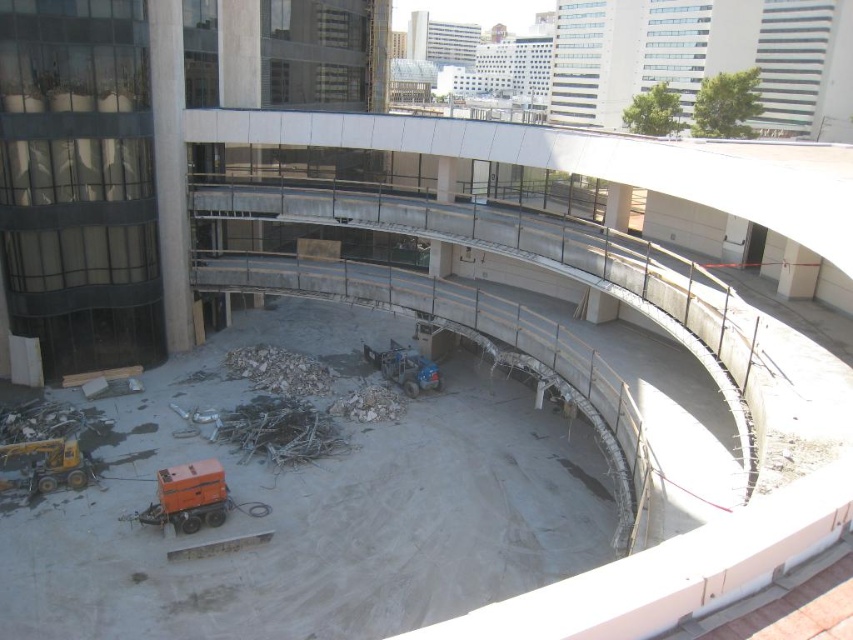
You are a construction worker standing at the edge of the construction site. You need to reach the orange rubberized machine at center to check its fuel level. Considering the distance, can you safely walk to it without needing any additional equipment?

The orange rubberized machine at center is 61.26 feet away from the viewer. Since this distance is manageable on foot, you can safely walk to it without needing additional equipment.

You are a construction worker standing at the orange generator near the bottom left corner of the construction site. You need to reach the curved walkway in the middle of the site. There are two points marked on your map as point A at coordinates point A is point [177,499] and point B at coordinates point B is point [422,355]. Which point should you head towards to get closer to the walkway?

You should head towards point A at coordinates point A is point [177,499] because it is in front of point B at coordinates point B is point [422,355], meaning it is closer to the walkway.